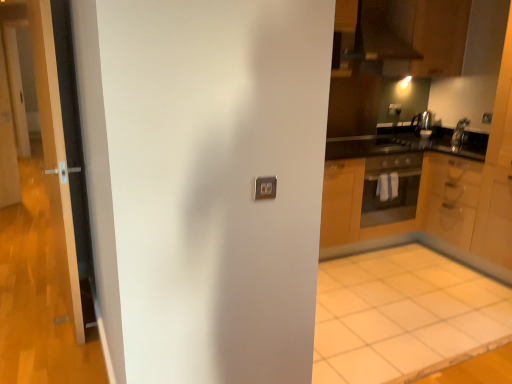
Question: Is point (3, 360) positioned closer to the camera than point (7, 104)?

Choices:
 (A) closer
 (B) farther

Answer: (A)

Question: In the image, is transparent glass door at left positioned in front of or behind clear glass screen door at left?

Choices:
 (A) front
 (B) behind

Answer: (A)

Question: Which object is the farthest from the satin silver kettle at upper right, the first appliance from the front?

Choices:
 (A) satin silver kettle at upper right, the second appliance from the right
 (B) transparent glass door at left
 (C) white tile floor at lower right
 (D) wooden cabinet at center, which is the 1th cabinetry in left-to-right order
 (E) matte gray electric outlet at upper right, marked as the second electric outlet in a back-to-front arrangement

Answer: (B)

Question: Which is nearer to the satin silver kettle at upper right, the 2th appliance when ordered from back to front?

Choices:
 (A) satin silver kettle at upper right, the second appliance from the right
 (B) clear glass screen door at left
 (C) matte gray electric outlet at upper right, which appears as the 2th electric outlet when viewed from the left
 (D) transparent glass door at left
 (E) matte silver outlet at center, which is the second electric outlet in right-to-left order

Answer: (C)